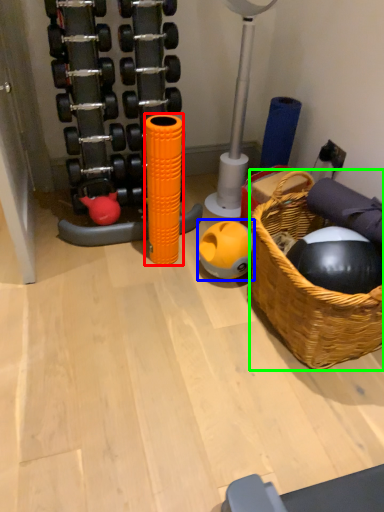
Question: Based on their relative distances, which object is nearer to toy (highlighted by a red box)? Choose from ball (highlighted by a blue box) and basket (highlighted by a green box).

Choices:
 (A) ball
 (B) basket

Answer: (A)